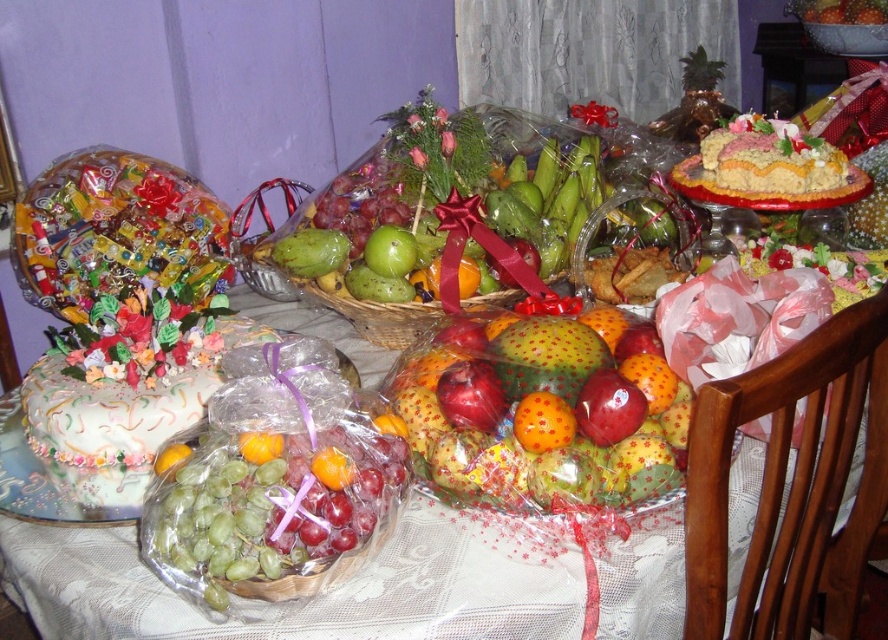
Question: Among these objects, which one is farthest from the camera?

Choices:
 (A) matte yellow cake at upper right
 (B) white frosted cake at lower left

Answer: (A)

Question: Can you confirm if speckled green mango at center is positioned below white frosted cake at lower left?

Choices:
 (A) no
 (B) yes

Answer: (B)

Question: From the image, what is the correct spatial relationship of speckled green mango at center in relation to white frosted cake at lower left?

Choices:
 (A) above
 (B) below

Answer: (B)

Question: Observing the image, what is the correct spatial positioning of speckled green mango at center in reference to matte yellow cake at upper right?

Choices:
 (A) below
 (B) above

Answer: (A)

Question: Which point is closer to the camera?

Choices:
 (A) (781, 132)
 (B) (542, 436)
 (C) (70, 445)

Answer: (B)

Question: Which point is farther to the camera?

Choices:
 (A) speckled green mango at center
 (B) matte yellow cake at upper right

Answer: (B)